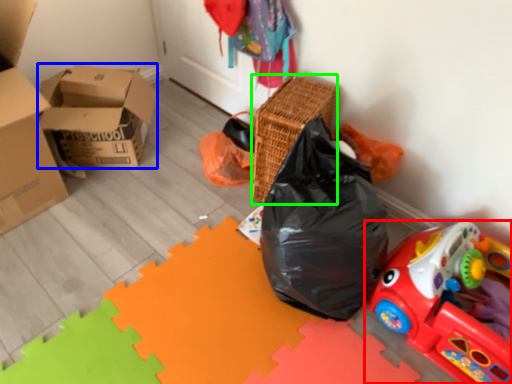
Question: Based on their relative distances, which object is nearer to toy (highlighted by a red box)? Choose from box (highlighted by a blue box) and basket (highlighted by a green box).

Choices:
 (A) box
 (B) basket

Answer: (B)